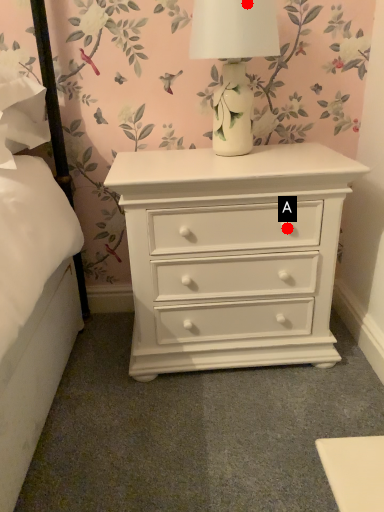
Question: Two points are circled on the image, labeled by A and B beside each circle. Which of the following is the farthest from the observer?

Choices:
 (A) A is further
 (B) B is further

Answer: (A)